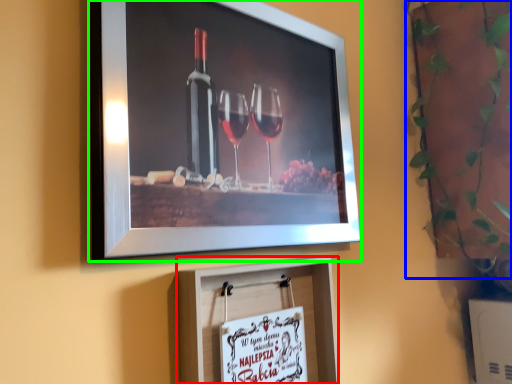
Question: Based on their relative distances, which object is nearer to picture frame (highlighted by a red box)? Choose from plant (highlighted by a blue box) and picture frame (highlighted by a green box).

Choices:
 (A) plant
 (B) picture frame

Answer: (B)